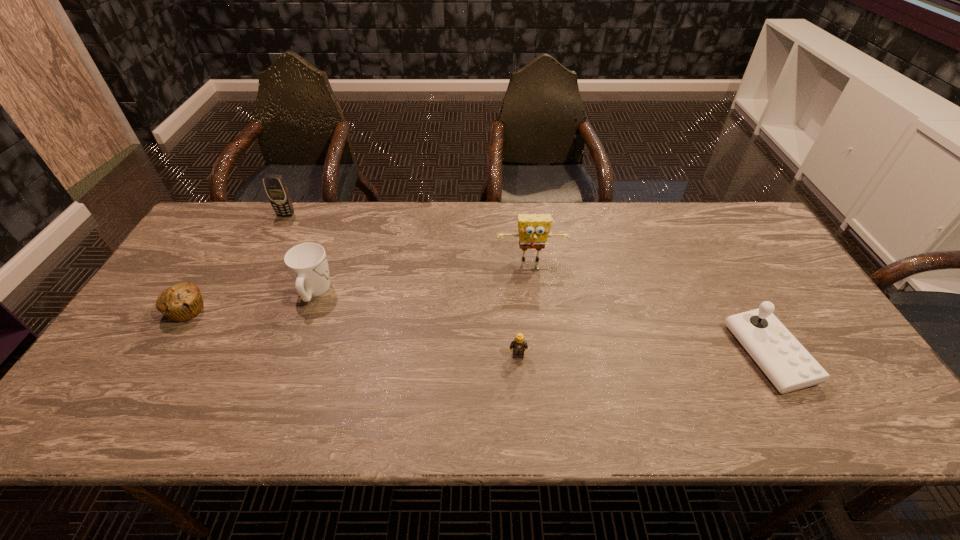
Locate an element on the screen. The image size is (960, 540). the fifth object from right to left is located at coordinates (277, 191).

Where is `cellular telephone`? This screenshot has width=960, height=540. cellular telephone is located at coordinates (277, 191).

The image size is (960, 540). I want to click on sponge, so click(534, 229).

This screenshot has height=540, width=960. I want to click on mug, so click(x=307, y=263).

Where is `the rightmost object`? The image size is (960, 540). the rightmost object is located at coordinates (789, 366).

Find the location of a particular element. The height and width of the screenshot is (540, 960). the leftmost object is located at coordinates point(183,301).

This screenshot has width=960, height=540. In order to click on Lego in this screenshot , I will do `click(519, 345)`.

Identify the location of vacant space located on the front face of the cellular telephone. The image size is (960, 540). (271, 245).

Identify the location of free location located 0.140m on the face of the sponge. (537, 304).

Find the location of a particular element. Image resolution: width=960 pixels, height=540 pixels. free spot located on the side of the mug with the handle is located at coordinates (332, 245).